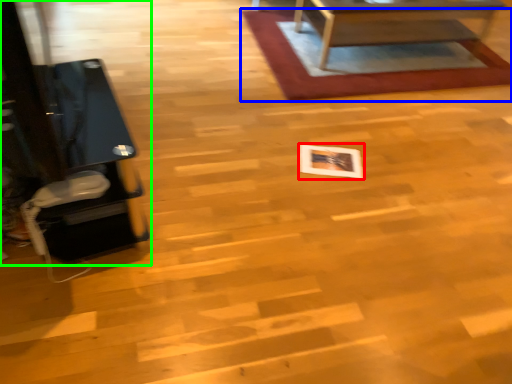
Question: Considering the real-world distances, which object is closest to square (highlighted by a red box)? mat (highlighted by a blue box) or furniture (highlighted by a green box).

Choices:
 (A) mat
 (B) furniture

Answer: (A)